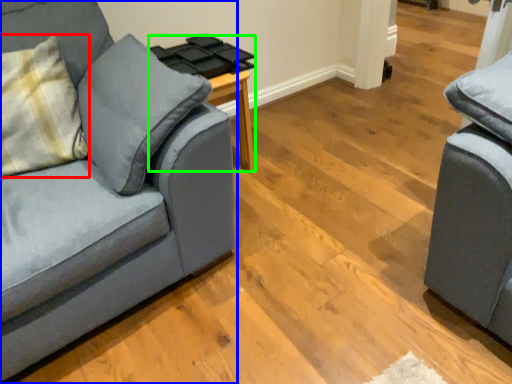
Question: Considering the real-world distances, which object is closest to throw pillow (highlighted by a red box)? studio couch (highlighted by a blue box) or side table (highlighted by a green box).

Choices:
 (A) studio couch
 (B) side table

Answer: (A)